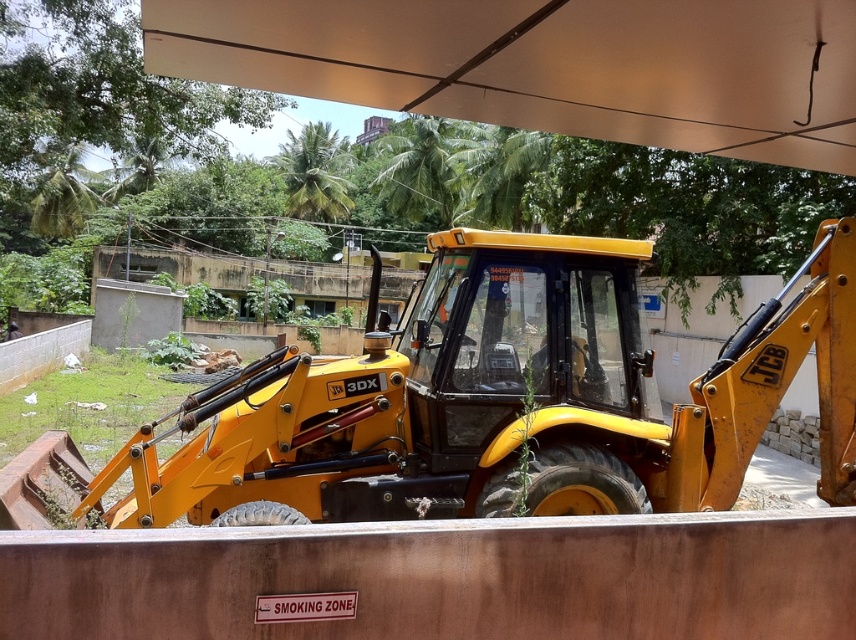
Does yellow metallic tractor at center appear under white matte canopy at upper center?

Indeed, yellow metallic tractor at center is positioned under white matte canopy at upper center.

Who is more forward, (311, 390) or (322, 81)?

Positioned in front is point (322, 81).

Locate an element on the screen. This screenshot has height=640, width=856. yellow metallic tractor at center is located at coordinates (484, 403).

Find the location of a particular element. yellow metallic tractor at center is located at coordinates (484, 403).